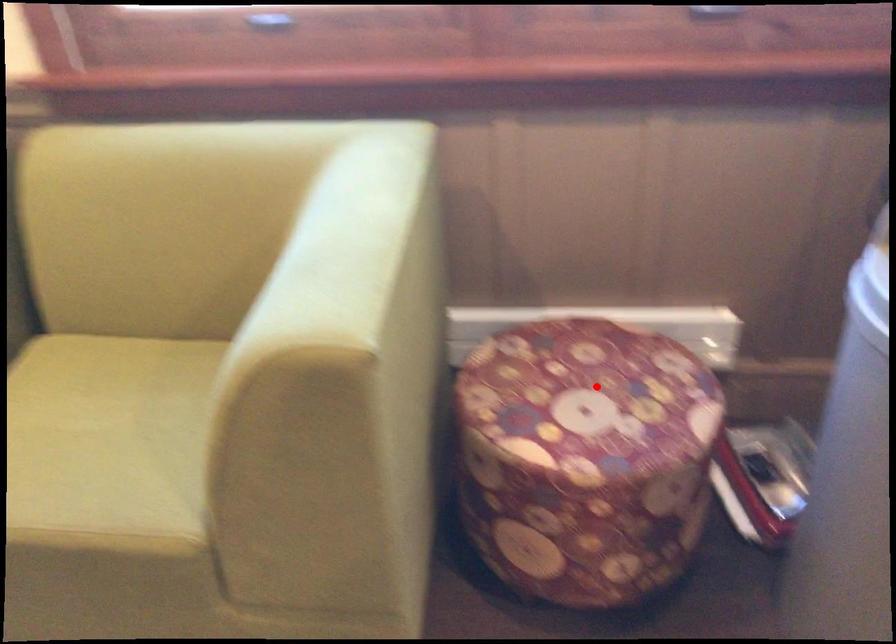
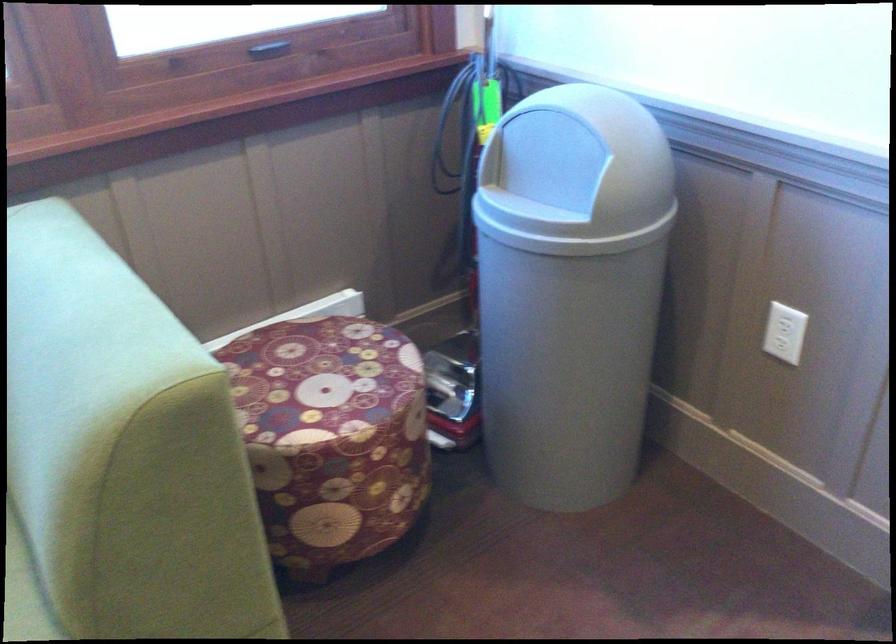
Question: I am providing you with two images of the same scene from different viewpoints. Given a red point in image1, look at the same physical point in image2. Is it:

Choices:
 (A) Closer to the viewpoint
 (B) Farther from the viewpoint

Answer: (B)